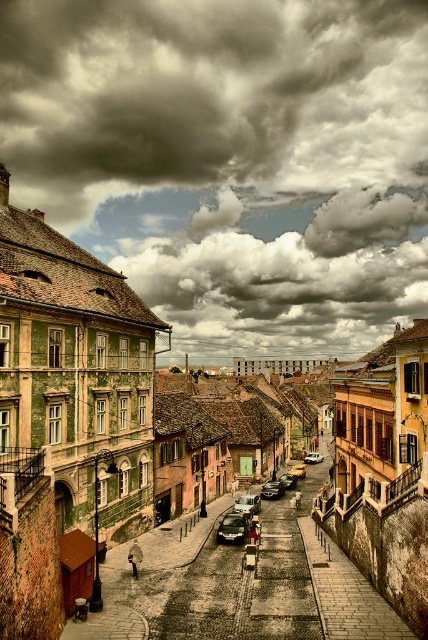
Question: Among these objects, which one is nearest to the camera?

Choices:
 (A) yellow matte taxi at center
 (B) yellow matte car at center

Answer: (B)

Question: Considering the real-world distances, which object is farthest from the shiny black sedan at center?

Choices:
 (A) shiny black car at center
 (B) shiny silver sedan at center
 (C) yellow matte car at center

Answer: (A)

Question: Where is matte stone alley at center located in relation to shiny silver car at center in the image?

Choices:
 (A) right
 (B) left

Answer: (B)

Question: Which point is closer to the camera taking this photo?

Choices:
 (A) (294, 563)
 (B) (264, 496)
 (C) (252, 500)
 (D) (294, 484)

Answer: (A)

Question: Does shiny silver sedan at center have a lesser width compared to shiny black sedan at center?

Choices:
 (A) no
 (B) yes

Answer: (A)

Question: Is shiny black car at center further to the viewer compared to shiny black sedan at center?

Choices:
 (A) yes
 (B) no

Answer: (B)